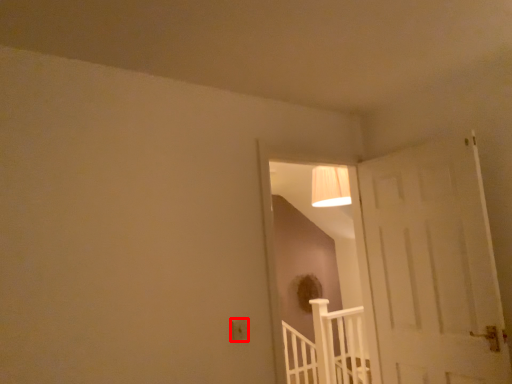
Question: Considering the relative positions of electric outlet (annotated by the red box) and rail in the image provided, where is electric outlet (annotated by the red box) located with respect to the staircase?

Choices:
 (A) right
 (B) left

Answer: (B)